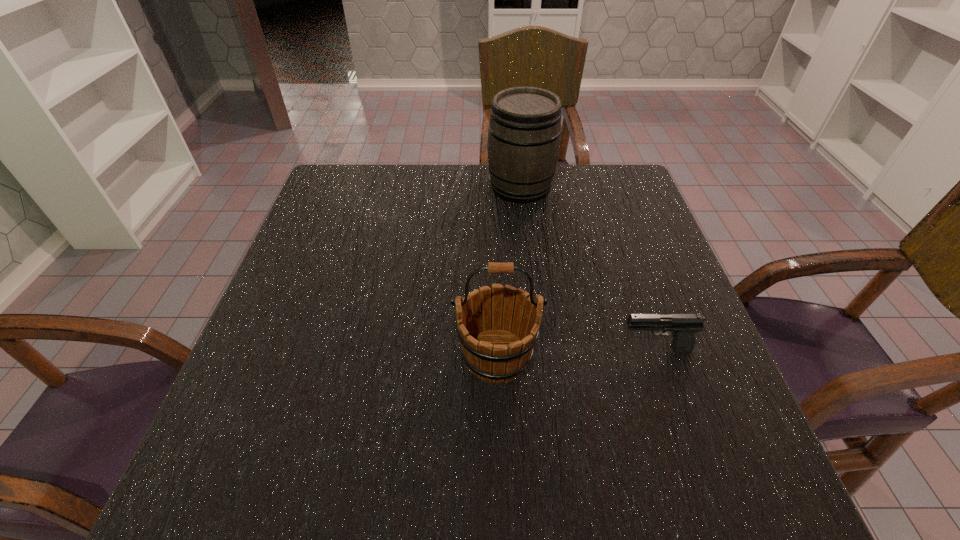
Identify the location of free space between the pistol and the nearer wine bucket. This screenshot has height=540, width=960. (576, 353).

What are the coordinates of `free point between the nearer wine bucket and the pistol` in the screenshot? It's located at (576, 353).

This screenshot has height=540, width=960. I want to click on free space between the farthest object and the shortest object, so click(x=588, y=268).

Where is `object identified as the closest to the farther wine bucket`? object identified as the closest to the farther wine bucket is located at coordinates click(x=495, y=349).

Select which object appears as the closest to the farther wine bucket. Please provide its 2D coordinates. Your answer should be formatted as a tuple, i.e. [(x, y)], where the tuple contains the x and y coordinates of a point satisfying the conditions above.

[(495, 349)]

Locate an element on the screen. Image resolution: width=960 pixels, height=540 pixels. vacant space that satisfies the following two spatial constraints: 1. on the back side of the farther wine bucket; 2. on the right side of the nearer wine bucket is located at coordinates (492, 186).

Where is `vacant point that satisfies the following two spatial constraints: 1. aim along the barrel of the rightmost object; 2. on the front side of the nearer wine bucket`? This screenshot has height=540, width=960. vacant point that satisfies the following two spatial constraints: 1. aim along the barrel of the rightmost object; 2. on the front side of the nearer wine bucket is located at coordinates (658, 356).